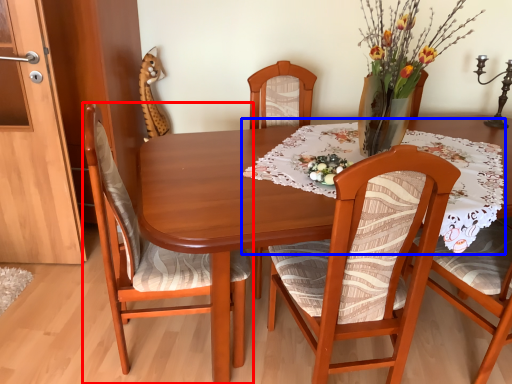
Question: Which point is closer to the camera, chair (highlighted by a red box) or tablecloth (highlighted by a blue box)?

Choices:
 (A) chair
 (B) tablecloth

Answer: (A)